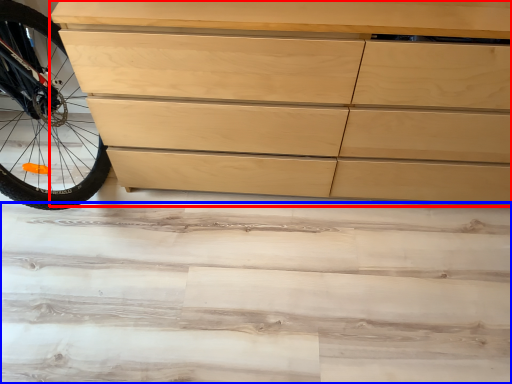
Question: Which point is further to the camera, chest of drawers (highlighted by a red box) or stair (highlighted by a blue box)?

Choices:
 (A) chest of drawers
 (B) stair

Answer: (B)